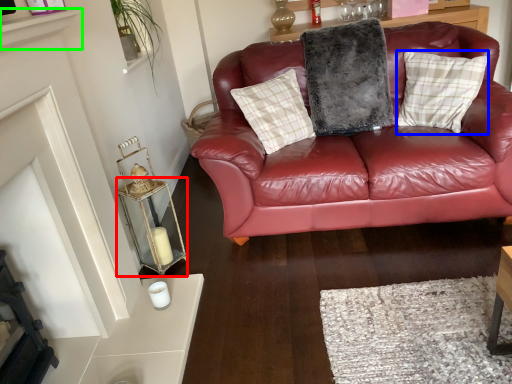
Question: Considering the real-world distances, which object is farthest from table (highlighted by a red box)? pillow (highlighted by a blue box) or shelf (highlighted by a green box)?

Choices:
 (A) pillow
 (B) shelf

Answer: (A)